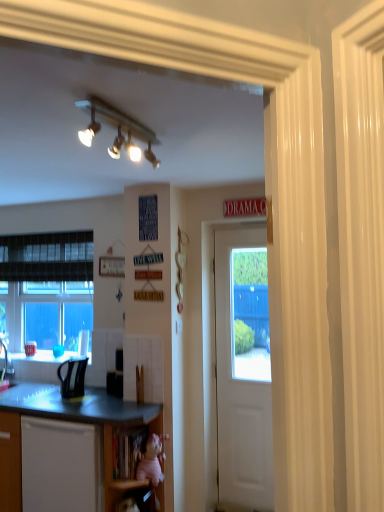
Question: Considering the relative sizes of matte black sink at lower left and wooden at lower center, which is counted as the 2th shelf, starting from the bottom, in the image provided, is matte black sink at lower left thinner than wooden at lower center, which is counted as the 2th shelf, starting from the bottom,?

Choices:
 (A) no
 (B) yes

Answer: (A)

Question: Is matte black sink at lower left wider than wooden at lower center, which is counted as the 2th shelf, starting from the bottom?

Choices:
 (A) yes
 (B) no

Answer: (A)

Question: Is matte black sink at lower left at the left side of wooden at lower center, which is counted as the 2th shelf, starting from the bottom?

Choices:
 (A) no
 (B) yes

Answer: (B)

Question: From the image's perspective, is matte black sink at lower left below wooden at lower center, which is counted as the 2th shelf, starting from the bottom?

Choices:
 (A) no
 (B) yes

Answer: (A)

Question: Could you tell me if matte black sink at lower left is turned towards wooden at lower center, which is counted as the 2th shelf, starting from the bottom?

Choices:
 (A) no
 (B) yes

Answer: (A)

Question: Is pink fabric doll at lower center, acting as the second shelf starting from the top, situated inside black matte microwave oven at lower center or outside?

Choices:
 (A) outside
 (B) inside

Answer: (A)

Question: From a real-world perspective, relative to black matte microwave oven at lower center, is pink fabric doll at lower center, acting as the second shelf starting from the top, vertically above or below?

Choices:
 (A) below
 (B) above

Answer: (A)

Question: Considering the positions of point (104, 433) and point (105, 373), is point (104, 433) closer or farther from the camera than point (105, 373)?

Choices:
 (A) farther
 (B) closer

Answer: (B)

Question: Is pink fabric doll at lower center, acting as the 1th shelf starting from the bottom, wider or thinner than black matte microwave oven at lower center?

Choices:
 (A) wide
 (B) thin

Answer: (A)

Question: In terms of height, does wooden at lower center, marked as the first shelf in a top-to-bottom arrangement, look taller or shorter compared to matte black kettle at left?

Choices:
 (A) short
 (B) tall

Answer: (B)

Question: From a real-world perspective, relative to matte black kettle at left, is wooden at lower center, marked as the first shelf in a top-to-bottom arrangement, vertically above or below?

Choices:
 (A) above
 (B) below

Answer: (B)

Question: From the image's perspective, is wooden at lower center, marked as the first shelf in a top-to-bottom arrangement, located above or below matte black kettle at left?

Choices:
 (A) below
 (B) above

Answer: (A)

Question: Considering the positions of point (122, 448) and point (79, 364), is point (122, 448) closer or farther from the camera than point (79, 364)?

Choices:
 (A) farther
 (B) closer

Answer: (B)

Question: Is point click(137, 433) positioned closer to the camera than point click(19, 396)?

Choices:
 (A) closer
 (B) farther

Answer: (A)

Question: Relative to black laminate countertop at lower left, is wooden at lower center, marked as the first shelf in a top-to-bottom arrangement, in front or behind?

Choices:
 (A) behind
 (B) front

Answer: (A)